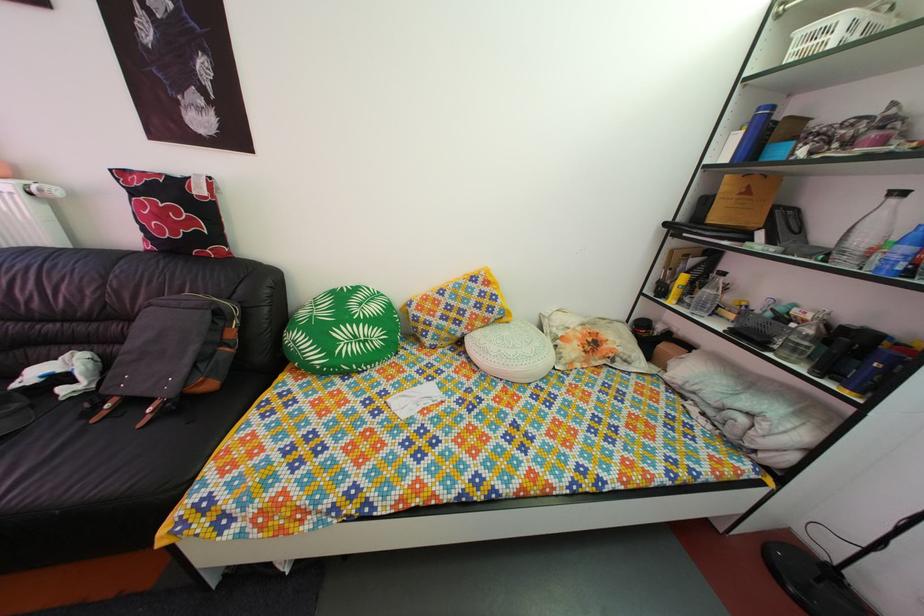
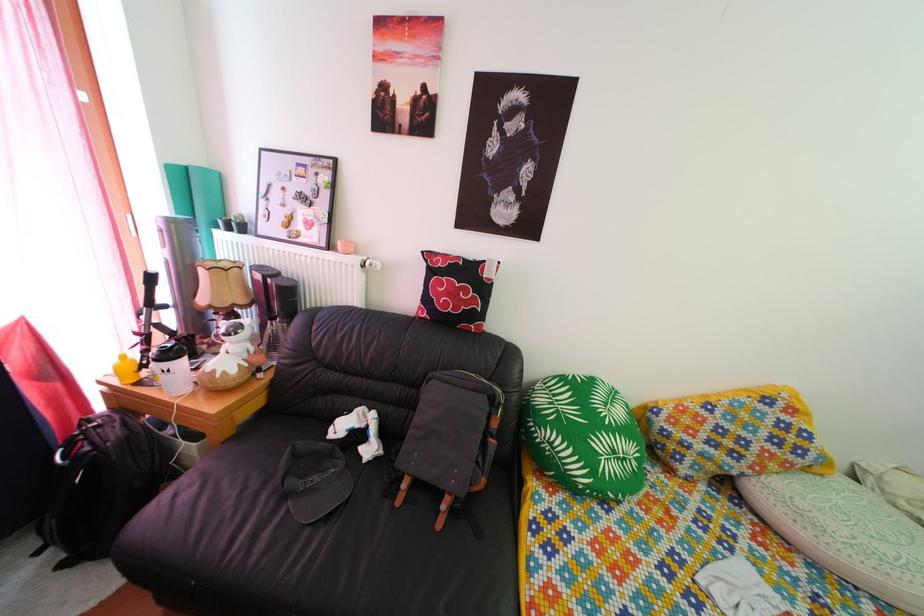
Question: What movement of the cameraman would produce the second image?

Choices:
 (A) Left
 (B) Right
 (C) Forward
 (D) Backward

Answer: (A)